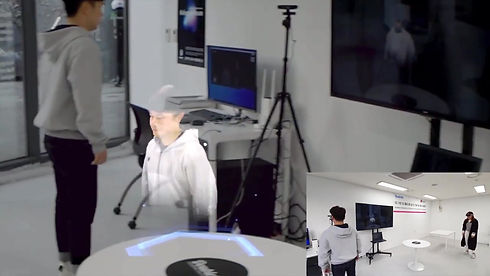
Where is `left chair wheel`? left chair wheel is located at coordinates (116, 210).